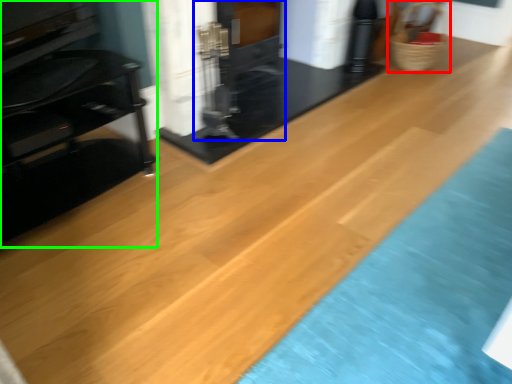
Question: Which object is the closest to the basket (highlighted by a red box)? Choose among these: fireplace (highlighted by a blue box) or furniture (highlighted by a green box).

Choices:
 (A) fireplace
 (B) furniture

Answer: (A)